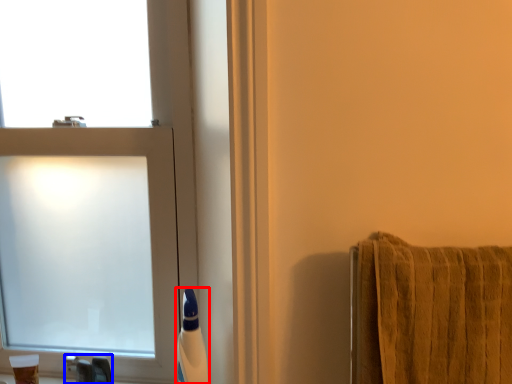
Question: Which object is closer to the camera taking this photo, toiletry (highlighted by a red box) or faucet (highlighted by a blue box)?

Choices:
 (A) toiletry
 (B) faucet

Answer: (A)